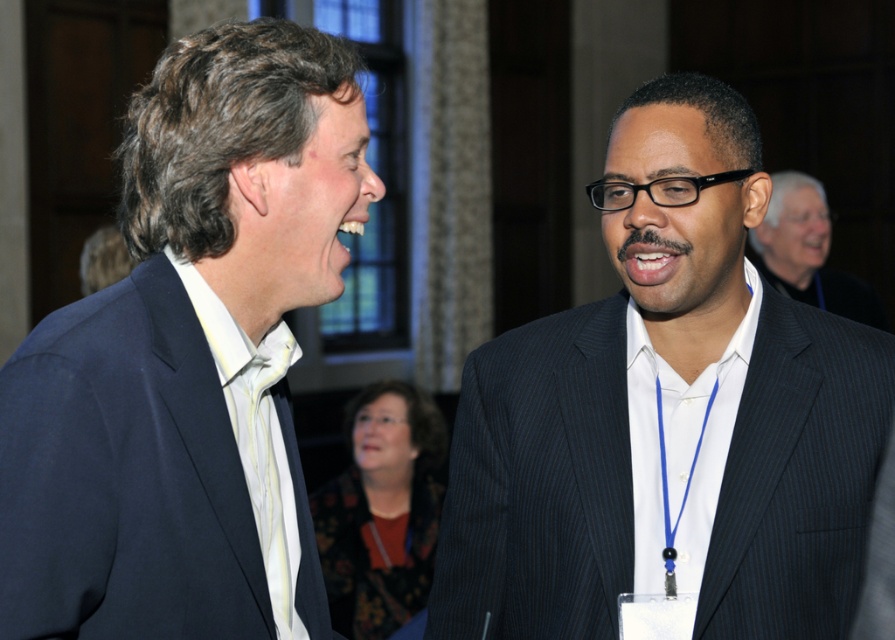
Question: From the image, what is the correct spatial relationship of matte blue suit at left in relation to black pinstripe suit at center?

Choices:
 (A) above
 (B) below

Answer: (B)

Question: Based on their relative distances, which object is nearer to the dark pinstripe suit at center?

Choices:
 (A) black pinstripe suit at center
 (B) yellow striped tie at left
 (C) matte blue suit at left

Answer: (C)

Question: Where is matte blue suit at left located in relation to dark pinstripe suit at center in the image?

Choices:
 (A) right
 (B) left

Answer: (B)

Question: In this image, where is dark pinstripe suit at center located relative to black pinstripe suit at center?

Choices:
 (A) above
 (B) below

Answer: (B)

Question: Which point is farther from the camera taking this photo?

Choices:
 (A) (354, 198)
 (B) (231, 384)
 (C) (752, 168)

Answer: (C)

Question: Which of these objects is positioned farthest from the dark pinstripe suit at center?

Choices:
 (A) black pinstripe suit at center
 (B) yellow striped tie at left
 (C) matte blue suit at left

Answer: (A)